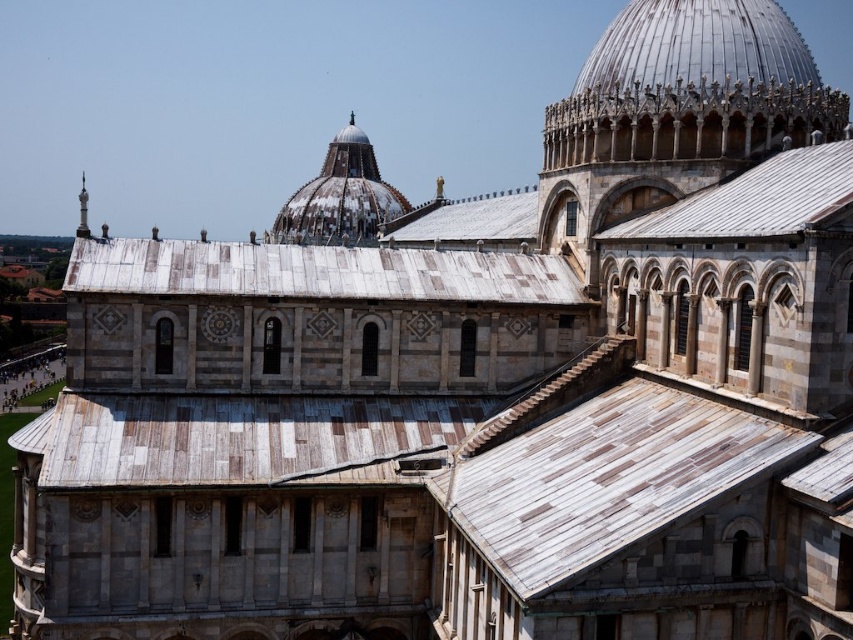
Question: Is metallic silver dome at upper right below white shingles at upper right?

Choices:
 (A) yes
 (B) no

Answer: (B)

Question: Can you confirm if weathered wood roof at center is positioned to the right of silver metallic spire at upper left?

Choices:
 (A) no
 (B) yes

Answer: (B)

Question: Considering the relative positions of white shingles at upper right and silver metallic spire at upper left in the image provided, where is white shingles at upper right located with respect to silver metallic spire at upper left?

Choices:
 (A) left
 (B) right

Answer: (B)

Question: Which of these objects is positioned closest to the silver metallic spire at upper left?

Choices:
 (A) white weathered dome at center
 (B) white shingles at upper right
 (C) weathered wood roof at center

Answer: (C)

Question: Which point is farther to the camera?

Choices:
 (A) metallic silver dome at upper right
 (B) weathered wood roof at center
 (C) silver metallic spire at upper left

Answer: (C)

Question: Which of the following is the closest to the observer?

Choices:
 (A) weathered wood roof at center
 (B) silver metallic spire at upper left
 (C) white weathered dome at center
 (D) metallic silver dome at upper right

Answer: (A)